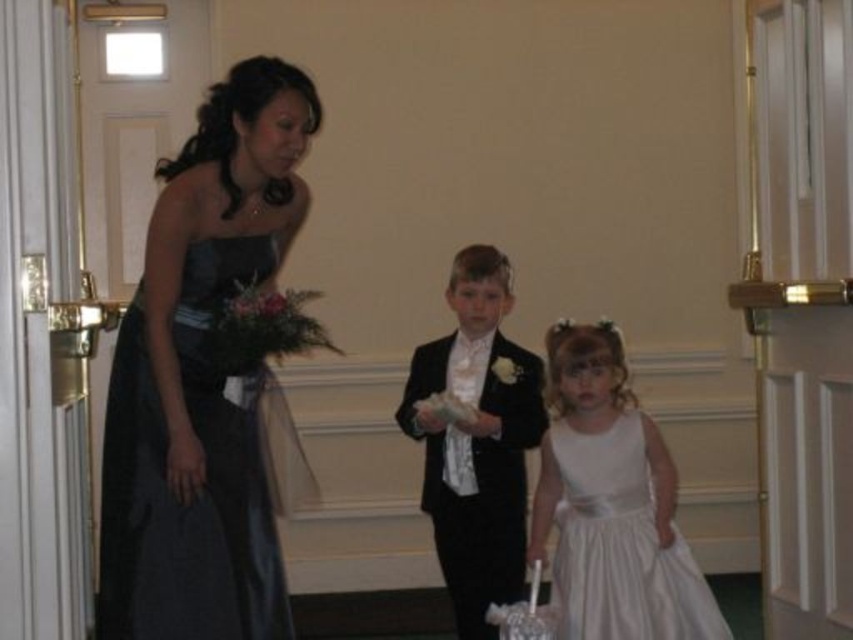
Is point (230, 115) positioned before point (589, 588)?

That is True.

Which of these two, shiny dark blue dress at left or white satin dress at center, stands taller?

Standing taller between the two is shiny dark blue dress at left.

In the scene shown: Who is more forward, (x=201, y=225) or (x=599, y=624)?

Point (x=201, y=225) is in front.

Locate an element on the screen. The height and width of the screenshot is (640, 853). shiny dark blue dress at left is located at coordinates (202, 378).

Does white satin dress at center come in front of black satin suit at center?

Yes, it is.

Is point (583, 525) farther from camera compared to point (405, 392)?

That is False.

Find the location of a particular element. Image resolution: width=853 pixels, height=640 pixels. white satin dress at center is located at coordinates (611, 502).

Between shiny dark blue dress at left and black satin suit at center, which one appears on the right side from the viewer's perspective?

From the viewer's perspective, black satin suit at center appears more on the right side.

Is shiny dark blue dress at left to the left of black satin suit at center from the viewer's perspective?

Correct, you'll find shiny dark blue dress at left to the left of black satin suit at center.

Find the location of a particular element. The image size is (853, 640). shiny dark blue dress at left is located at coordinates (202, 378).